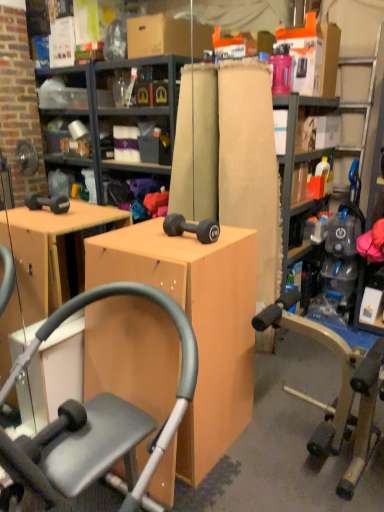
The image size is (384, 512). I want to click on free space in front of matte black dumbbell at center, so click(x=182, y=252).